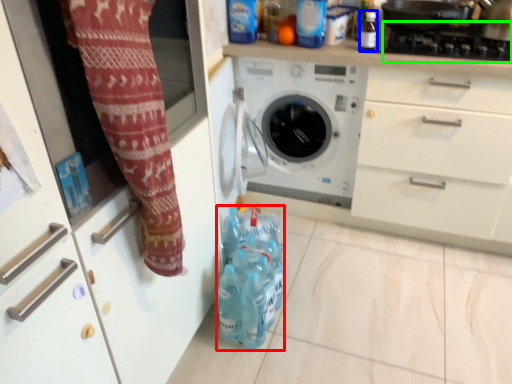
Question: Which is farther away from bottle (highlighted by a red box)? bottle (highlighted by a blue box) or gas stove (highlighted by a green box)?

Choices:
 (A) bottle
 (B) gas stove

Answer: (B)